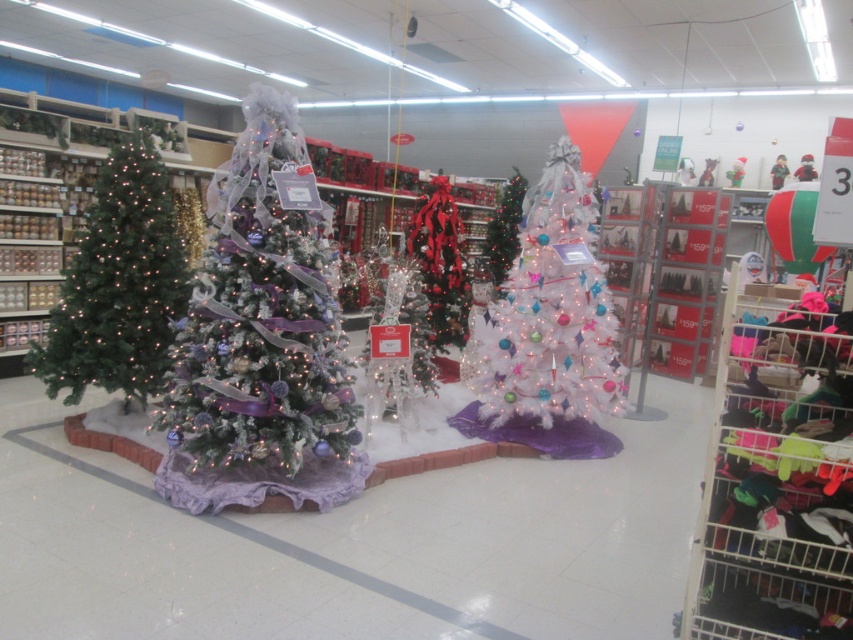
You are a store employee who needs to place a new decoration box that is 1.2 meters wide between the white glittery christmas tree at center and the green matte christmas tree at left. Based on the scene, will the space between them accommodate the decoration box?

The white glittery christmas tree at center is wider than the green matte christmas tree at left. However, the exact distance between them isn not specified in the provided information. Therefore, it is uncertain whether the 1.2 meter wide decoration box will fit.

You are a customer in the store looking at the two trees, the white glittery christmas tree at center and the green matte christmas tree at left. Which tree is located to the right of the other?

The white glittery christmas tree at center is positioned on the right side of the green matte christmas tree at left.

You are a delivery person who needs to move a 10 feet long ladder through the space between the white glittery christmas tree at center and the white frosted christmas tree at center. Is there enough space to move the ladder without touching the trees?

The white glittery christmas tree at center and white frosted christmas tree at center are 10.27 feet apart from each other. Since the ladder is 10 feet long, there is enough space to move it between them without touching the trees.